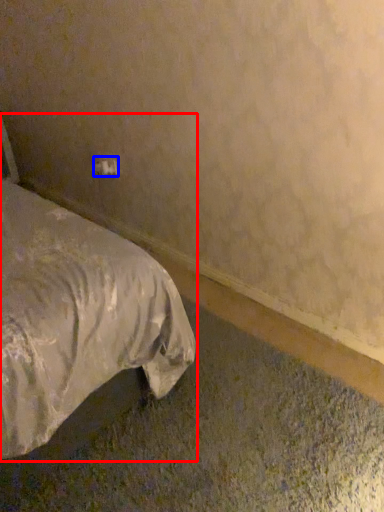
Question: Which object is closer to the camera taking this photo, bed (highlighted by a red box) or electric outlet (highlighted by a blue box)?

Choices:
 (A) bed
 (B) electric outlet

Answer: (A)